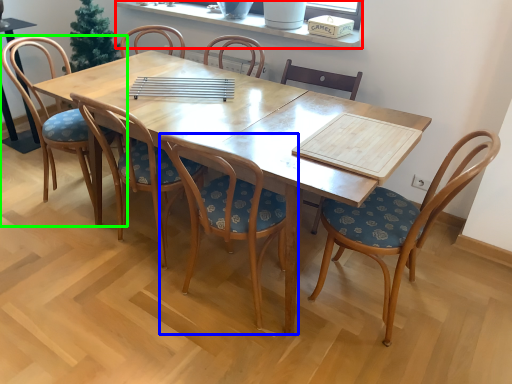
Question: Which is farther away from window sill (highlighted by a red box)? chair (highlighted by a blue box) or chair (highlighted by a green box)?

Choices:
 (A) chair
 (B) chair

Answer: (A)